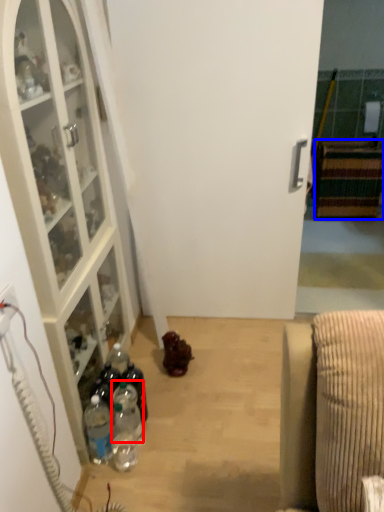
Question: Which object is further to the camera taking this photo, bottle (highlighted by a red box) or cabinetry (highlighted by a blue box)?

Choices:
 (A) bottle
 (B) cabinetry

Answer: (B)